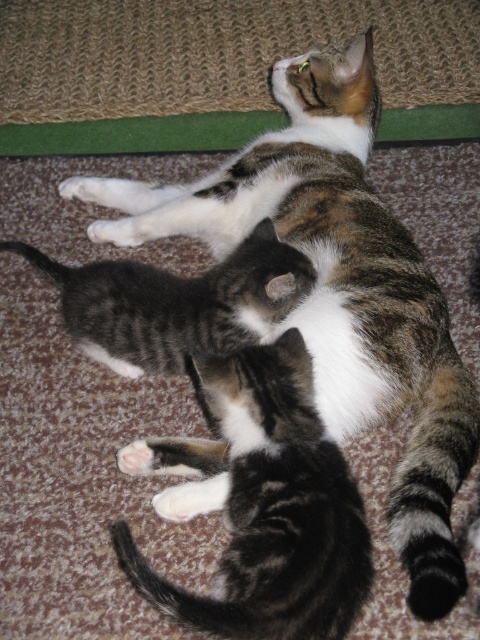
Question: Which of the following is the closest to the observer?

Choices:
 (A) (332, 624)
 (B) (299, 289)

Answer: (A)

Question: Is striped fur kitten at center above gray striped kitten at center?

Choices:
 (A) no
 (B) yes

Answer: (A)

Question: Is striped fur kitten at center thinner than gray striped kitten at center?

Choices:
 (A) yes
 (B) no

Answer: (A)

Question: Does striped fur kitten at center appear on the left side of gray striped kitten at center?

Choices:
 (A) no
 (B) yes

Answer: (A)

Question: Which point is closer to the camera taking this photo?

Choices:
 (A) click(321, 593)
 (B) click(121, 307)

Answer: (A)